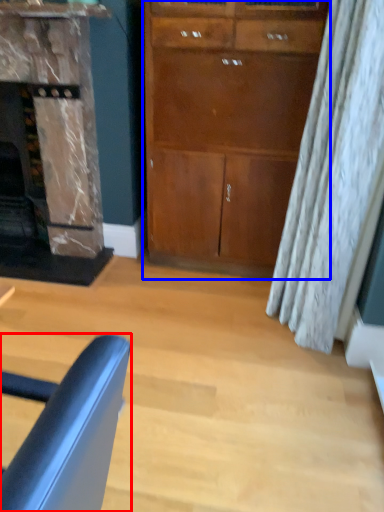
Question: Which object is further to the camera taking this photo, chair (highlighted by a red box) or cabinetry (highlighted by a blue box)?

Choices:
 (A) chair
 (B) cabinetry

Answer: (B)